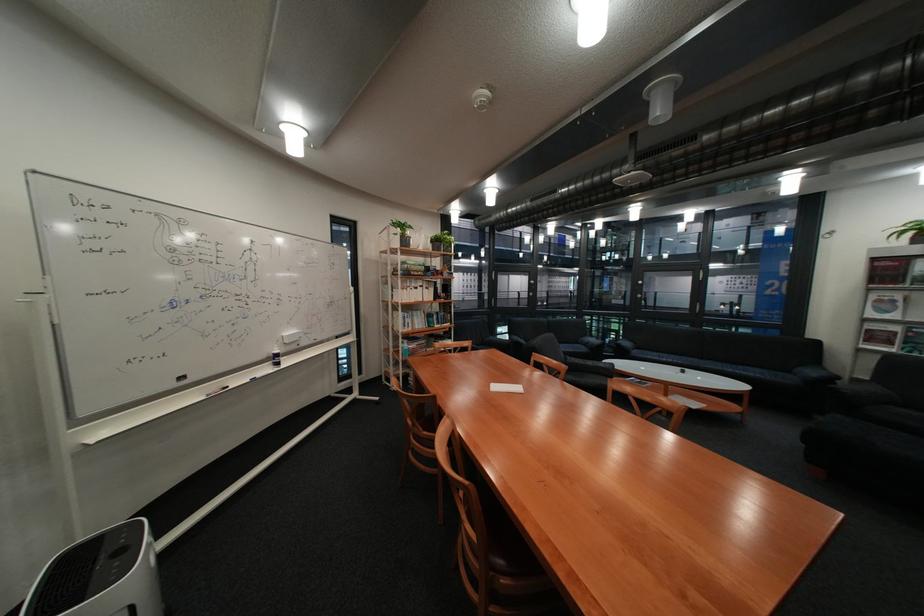
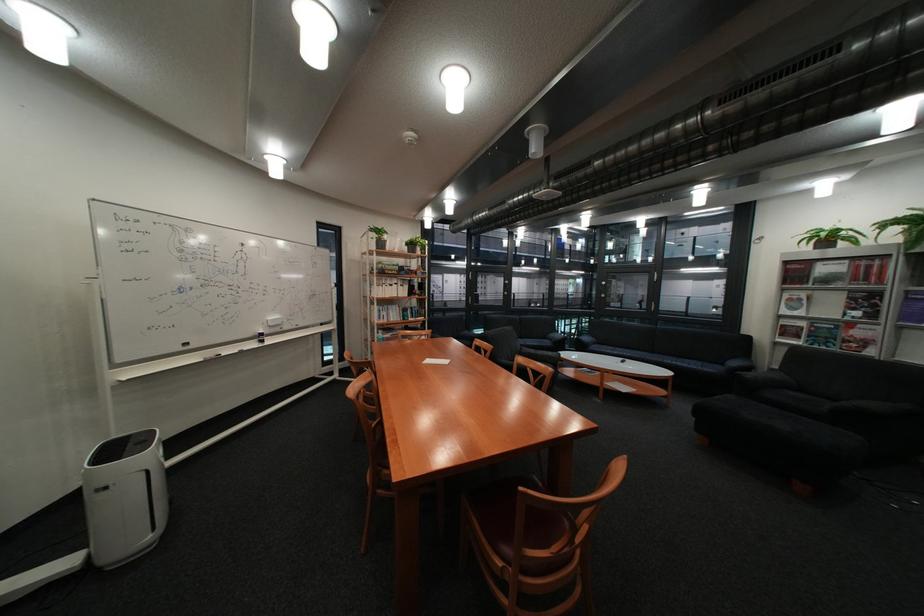
Where in the second image is the point corresponding to pixel 604 363 from the first image?

(555, 353)